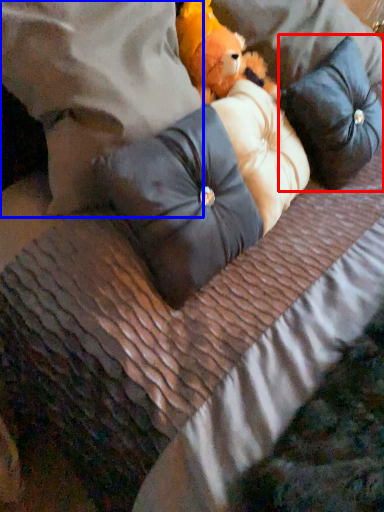
Question: Which object is closer to the camera taking this photo, pillow (highlighted by a red box) or pillow (highlighted by a blue box)?

Choices:
 (A) pillow
 (B) pillow

Answer: (B)